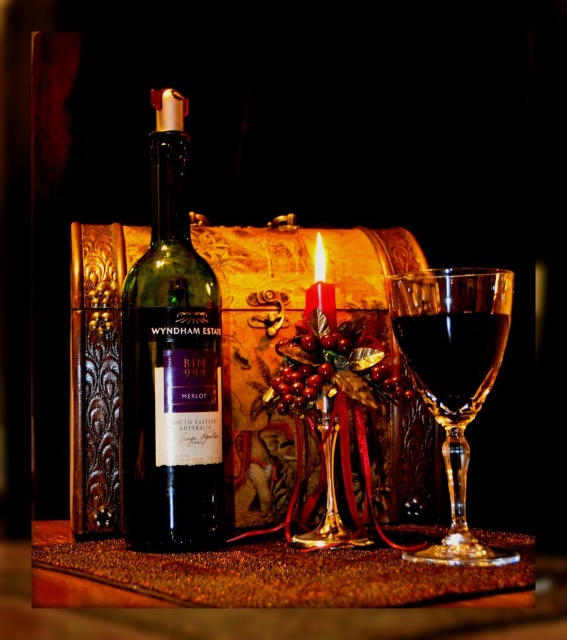
Looking at this image, can you confirm if green glass bottle at center is wider than dark glass wine at center?

In fact, green glass bottle at center might be narrower than dark glass wine at center.

Is point (175, 275) farther from viewer compared to point (399, 321)?

Yes, it is.

At what (x,y) coordinates should I click in order to perform the action: click on green glass bottle at center. Please return your answer as a coordinate pair (x, y). Looking at the image, I should click on (171, 364).

Which is below, green glass bottle at center or shiny brown table at center?

shiny brown table at center is lower down.

Is point (172, 248) positioned before point (272, 589)?

That is False.

Identify the location of green glass bottle at center. (171, 364).

Does shiny brown table at center have a lesser height compared to dark glass wine at center?

Yes.

Does shiny brown table at center appear on the left side of dark glass wine at center?

Indeed, shiny brown table at center is positioned on the left side of dark glass wine at center.

Which is in front, point (507, 538) or point (469, 358)?

Point (469, 358)

At what (x,y) coordinates should I click in order to perform the action: click on shiny brown table at center. Please return your answer as a coordinate pair (x, y). This screenshot has height=640, width=567. Looking at the image, I should click on (265, 576).